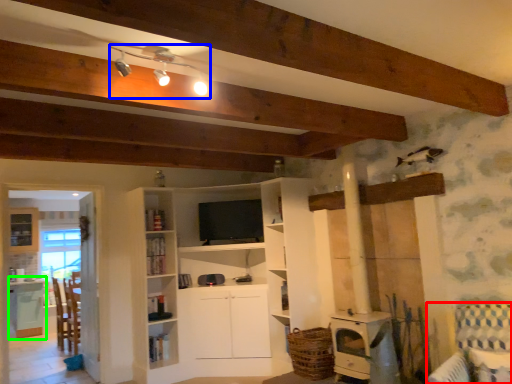
Question: Considering the real-world distances, which object is farthest from armchair (highlighted by a red box)? light fixture (highlighted by a blue box) or table (highlighted by a green box)?

Choices:
 (A) light fixture
 (B) table

Answer: (B)